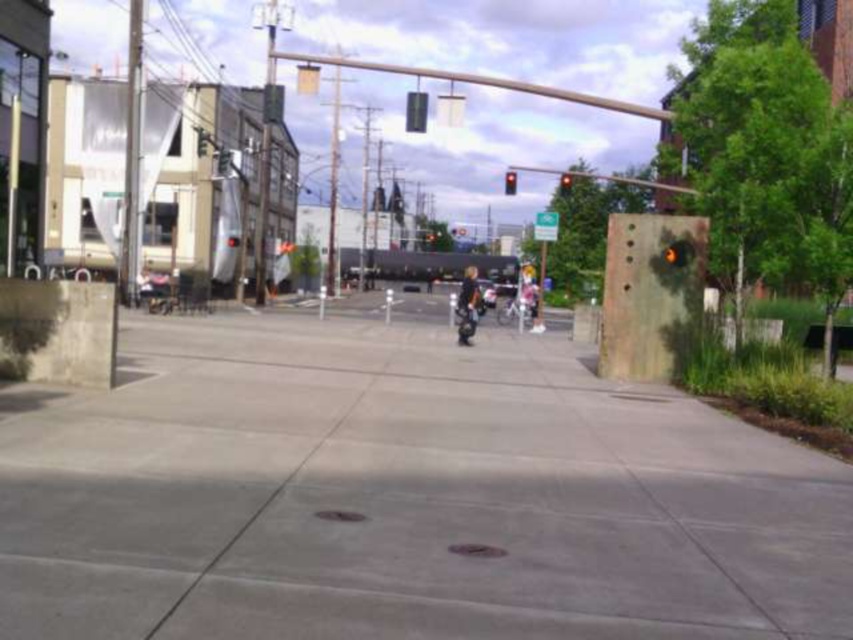
You are a delivery drone operator. Your drone needs to land on the gray concrete pavement at center. The drone is 1.2 meters tall. Will the red glass traffic light at upper center interfere with the landing?

The gray concrete pavement at center is shorter than the red glass traffic light at upper center, so the traffic light is taller. Since the drone is 1.2 meters tall, there might be a risk of collision if the traffic light is taller than 1.2 meters. However, the description only states the pavement is shorter than the traffic light, but does not provide exact heights. Therefore, it is uncertain if the drone can land safely without interference.